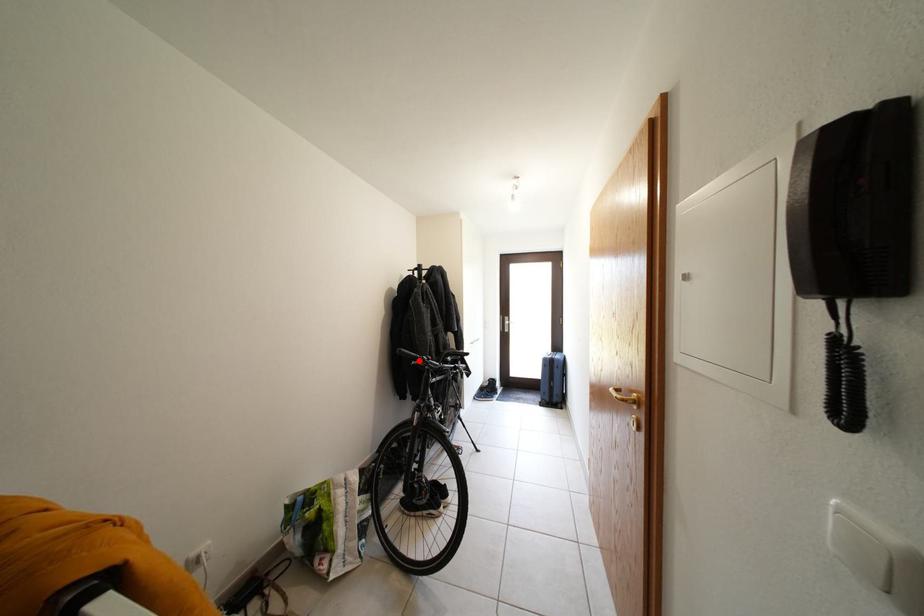
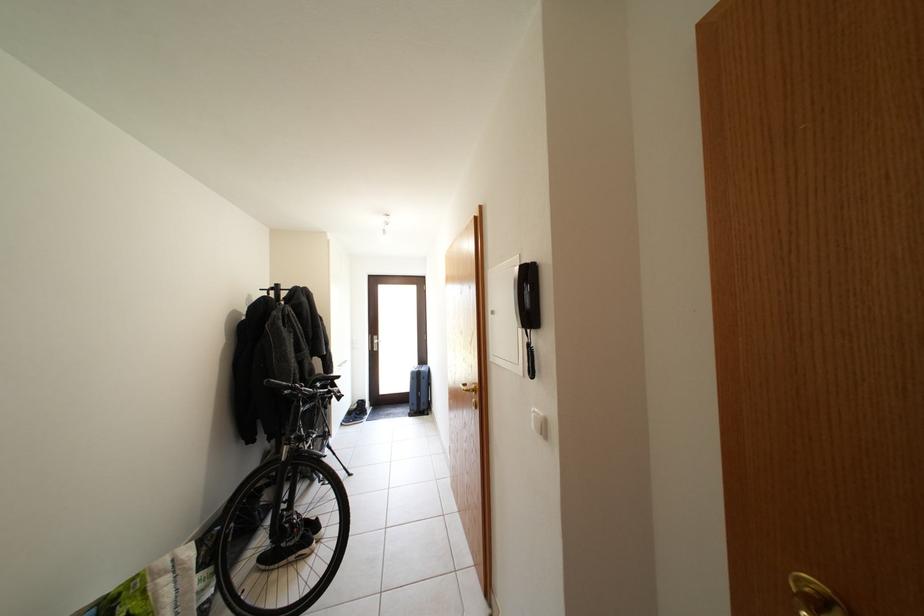
Find the pixel in the second image that matches the highlighted location in the first image.

(289, 390)